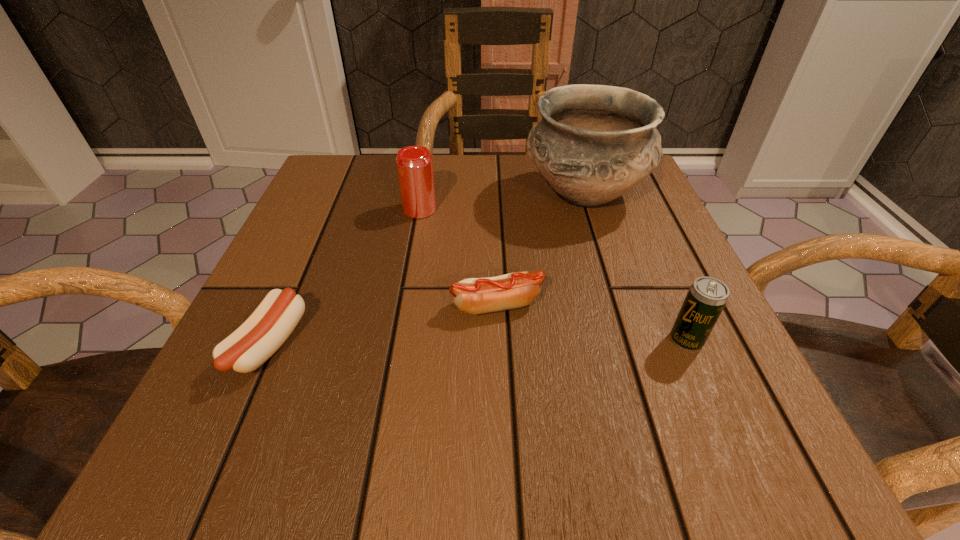
Identify the location of vacant space located 0.190m on the front of the right sausage. The height and width of the screenshot is (540, 960). (503, 440).

You are a GUI agent. You are given a task and a screenshot of the screen. Output one action in this format:
    pyautogui.click(x=<x>, y=<y>)
    Task: Click on the blank space located on the back of the left sausage
    This screenshot has width=960, height=540.
    Given the screenshot: What is the action you would take?
    pyautogui.click(x=317, y=235)

At what (x,y) coordinates should I click in order to perform the action: click on pottery that is at the far edge. Please return your answer as a coordinate pair (x, y). This screenshot has height=540, width=960. Looking at the image, I should click on (594, 143).

This screenshot has width=960, height=540. I want to click on beer can that is positioned at the far edge, so click(414, 163).

Where is `object that is at the left edge`? This screenshot has width=960, height=540. object that is at the left edge is located at coordinates (268, 327).

Identify the location of pottery positioned at the right edge. (594, 143).

The width and height of the screenshot is (960, 540). In order to click on beer can located at the right edge in this screenshot , I will do `click(706, 298)`.

Where is `object located in the far right corner section of the desktop`? Image resolution: width=960 pixels, height=540 pixels. object located in the far right corner section of the desktop is located at coordinates (594, 143).

You are a GUI agent. You are given a task and a screenshot of the screen. Output one action in this format:
    pyautogui.click(x=<x>, y=<y>)
    Task: Click on the vacant space at the far edge of the desktop
    The width and height of the screenshot is (960, 540).
    Given the screenshot: What is the action you would take?
    pyautogui.click(x=471, y=180)

This screenshot has height=540, width=960. What are the coordinates of `free space at the near edge` in the screenshot? It's located at (543, 416).